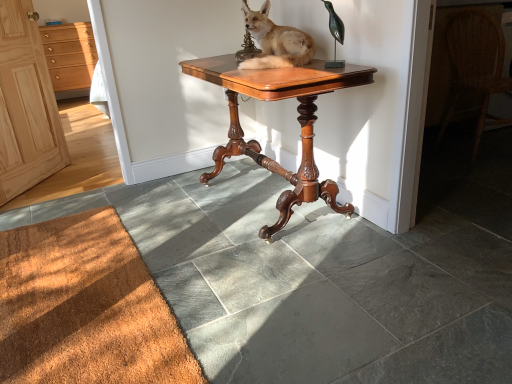
Question: From a real-world perspective, is light wood cabinet at left positioned under brown textured mat at lower left based on gravity?

Choices:
 (A) no
 (B) yes

Answer: (A)

Question: Are light wood cabinet at left and brown textured mat at lower left located far from each other?

Choices:
 (A) yes
 (B) no

Answer: (A)

Question: From the image's perspective, is light wood cabinet at left below brown textured mat at lower left?

Choices:
 (A) no
 (B) yes

Answer: (A)

Question: Does light wood cabinet at left appear on the right side of brown textured mat at lower left?

Choices:
 (A) no
 (B) yes

Answer: (A)

Question: Does light wood cabinet at left have a greater height compared to brown textured mat at lower left?

Choices:
 (A) yes
 (B) no

Answer: (A)

Question: Is woven wicker chair at right to the left or to the right of mahogany wood table at center in the image?

Choices:
 (A) left
 (B) right

Answer: (B)

Question: Is point (451, 84) positioned closer to the camera than point (266, 165)?

Choices:
 (A) closer
 (B) farther

Answer: (B)

Question: In the image, is woven wicker chair at right positioned in front of or behind mahogany wood table at center?

Choices:
 (A) front
 (B) behind

Answer: (B)

Question: From a real-world perspective, relative to mahogany wood table at center, is woven wicker chair at right vertically above or below?

Choices:
 (A) below
 (B) above

Answer: (B)

Question: Is point (57, 57) closer or farther from the camera than point (271, 61)?

Choices:
 (A) closer
 (B) farther

Answer: (B)

Question: From a real-world perspective, relative to brown fur stuffed fox at center, is light wood cabinet at left vertically above or below?

Choices:
 (A) below
 (B) above

Answer: (A)

Question: Would you say light wood cabinet at left is to the left or to the right of brown fur stuffed fox at center in the picture?

Choices:
 (A) right
 (B) left

Answer: (B)

Question: Is light wood cabinet at left in front of or behind brown fur stuffed fox at center in the image?

Choices:
 (A) front
 (B) behind

Answer: (B)

Question: Considering the positions of point (71, 49) and point (30, 309), is point (71, 49) closer or farther from the camera than point (30, 309)?

Choices:
 (A) closer
 (B) farther

Answer: (B)

Question: Looking at their shapes, would you say light wood cabinet at left is wider or thinner than brown textured mat at lower left?

Choices:
 (A) thin
 (B) wide

Answer: (A)